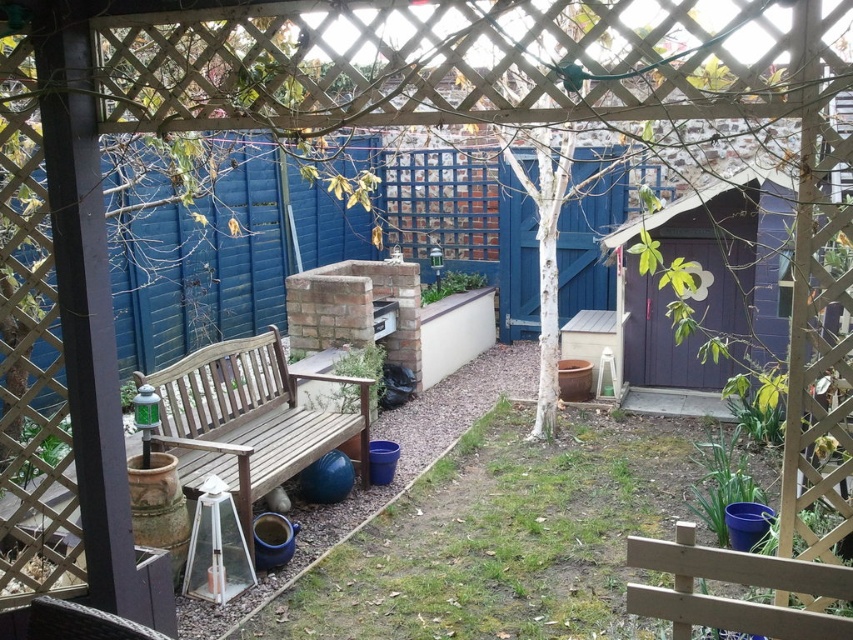
You are standing in the backyard and want to place a new potted plant exactly at the center of the green grass at center. According to the image, where should you place the potted plant?

The green grass at center is located at point 0.842 on the x axis and 0.584 on the y axis, so place the potted plant at those coordinates.

You are standing at the point labeled as point (x=497, y=538) in the backyard scene. What type of surface are you currently standing on?

You are standing on green grass at center, as the point (x=497, y=538) is located there.

You are planning to place a 40 inch wide garden statue between the green grass at center and the wooden bench at center. Will there be enough space for the statue to fit between them?

The distance between the green grass at center and the wooden bench at center is 38.81 inches. Since the statue is 40 inches wide, it will not fit between them as the space is narrower than the statue.